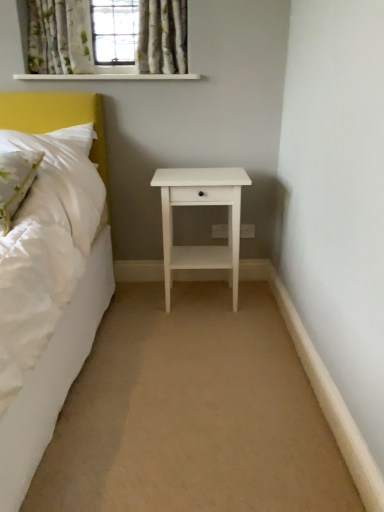
Question: Which is correct: patterned fabric curtain at upper center is inside green floral fabric curtain at upper left, which is counted as the 1th curtain, starting from the left, or outside of it?

Choices:
 (A) outside
 (B) inside

Answer: (A)

Question: Is point (31, 6) positioned closer to the camera than point (82, 12)?

Choices:
 (A) farther
 (B) closer

Answer: (B)

Question: Which object is the closest to the patterned fabric curtain at upper center?

Choices:
 (A) white matte nightstand at center
 (B) beige carpet at center
 (C) green floral fabric curtain at upper left, which is counted as the 1th curtain, starting from the left
 (D) floral fabric curtain at upper center, the 1th curtain positioned from the right
 (E) green floral fabric pillow at left

Answer: (C)

Question: Which object is the farthest from the white matte nightstand at center?

Choices:
 (A) floral fabric curtain at upper center, the 1th curtain positioned from the right
 (B) green floral fabric pillow at left
 (C) white wooden shelf at upper center
 (D) beige carpet at center
 (E) patterned fabric curtain at upper center

Answer: (E)